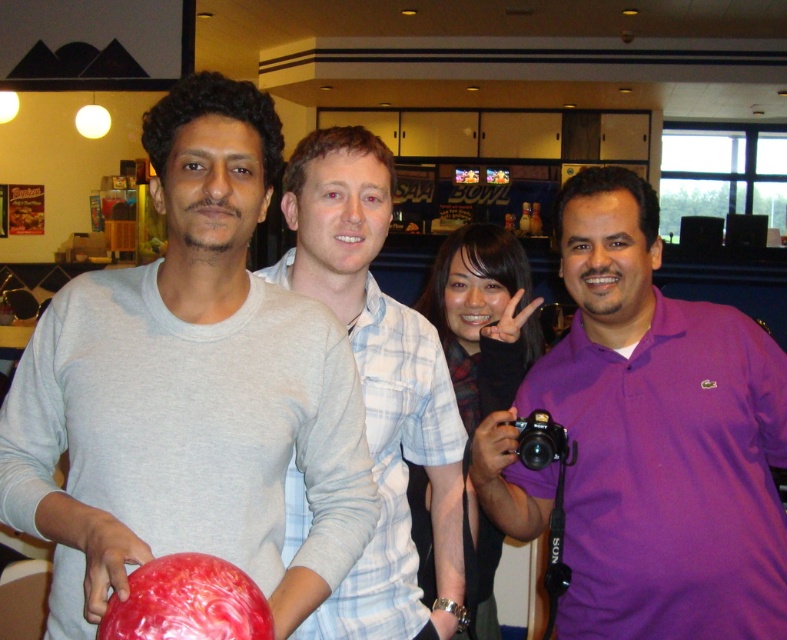
You are standing at the position of the fourth person in the purple polo shirt on the far right. You want to walk towards the red bowling ball in the foreground. Which point, point (x=235, y=236) or point (x=167, y=612), is closer to your current position?

Point (x=167, y=612) is closer to your current position because you are standing at the fourth person on the far right, and the point (x=167, y=612) is mentioned as being in front of point (x=235, y=236) according to their spatial relationship.

You are standing in the bowling alley and want to pick up the shiny red bowling ball at lower left. Is the light blue plaid shirt at center blocking your path to the ball?

The light blue plaid shirt at center is further to the viewer than the shiny red bowling ball at lower left, so the light blue plaid shirt at center is closer to you and blocking your path to the ball.

In the image of the group at the bowling alley, there is a light blue plaid shirt at center and a shiny red bowling ball at lower left. From the perspective of someone standing in front of the scene, which object is positioned to the right of the other?

The light blue plaid shirt at center is to the right of the shiny red bowling ball at lower left.